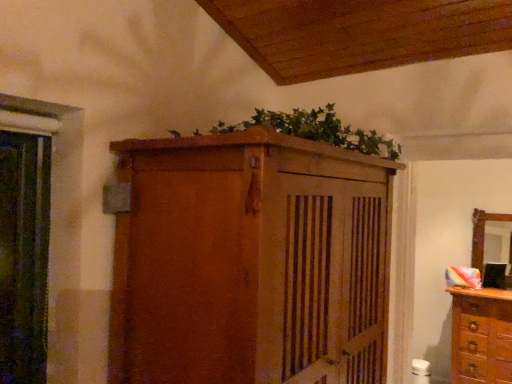
Question: From a real-world perspective, is wooden mirror at right below wooden dresser at right?

Choices:
 (A) yes
 (B) no

Answer: (B)

Question: Can you confirm if wooden mirror at right is wider than wooden dresser at right?

Choices:
 (A) no
 (B) yes

Answer: (A)

Question: Does wooden mirror at right have a smaller size compared to wooden dresser at right?

Choices:
 (A) no
 (B) yes

Answer: (B)

Question: From the image's perspective, is wooden mirror at right located beneath wooden dresser at right?

Choices:
 (A) no
 (B) yes

Answer: (A)

Question: Is wooden mirror at right not close to wooden dresser at right?

Choices:
 (A) yes
 (B) no

Answer: (B)

Question: From the image's perspective, is wooden mirror at right above wooden dresser at right?

Choices:
 (A) no
 (B) yes

Answer: (B)

Question: Is green leafy plant at upper center in contact with wooden dresser at right?

Choices:
 (A) no
 (B) yes

Answer: (A)

Question: Could wooden dresser at right be considered to be inside green leafy plant at upper center?

Choices:
 (A) yes
 (B) no

Answer: (B)

Question: Can you confirm if green leafy plant at upper center is bigger than wooden dresser at right?

Choices:
 (A) yes
 (B) no

Answer: (B)

Question: Is green leafy plant at upper center far from wooden dresser at right?

Choices:
 (A) no
 (B) yes

Answer: (B)

Question: Can you confirm if green leafy plant at upper center is positioned to the left of wooden dresser at right?

Choices:
 (A) yes
 (B) no

Answer: (A)

Question: From the image's perspective, is green leafy plant at upper center under wooden dresser at right?

Choices:
 (A) yes
 (B) no

Answer: (B)

Question: Would you say matte wooden cupboard at upper center is outside green leafy plant at upper center?

Choices:
 (A) no
 (B) yes

Answer: (B)